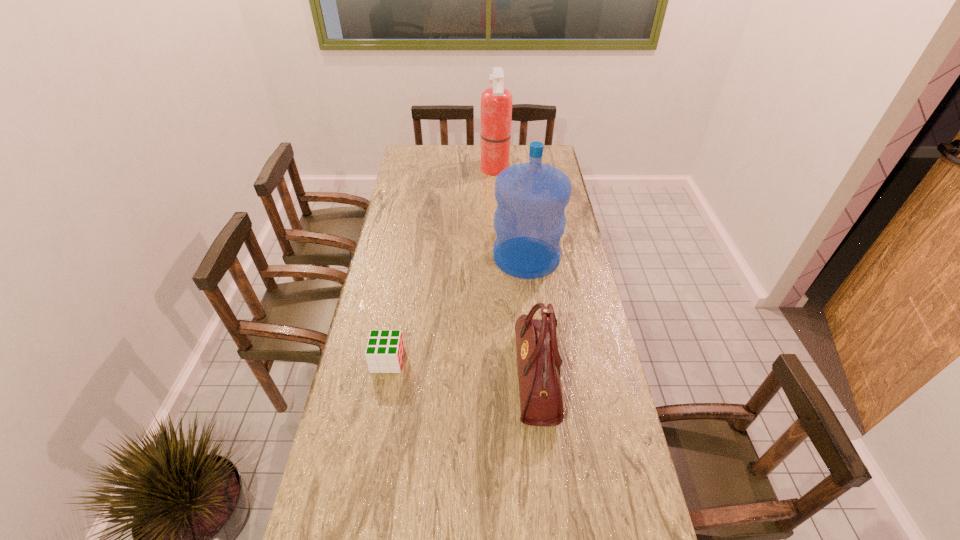
In order to click on free area in between the shortest object and the farthest object in this screenshot , I will do `click(442, 265)`.

Locate which object ranks third in proximity to the cube. Please provide its 2D coordinates. Your answer should be formatted as a tuple, i.e. [(x, y)], where the tuple contains the x and y coordinates of a point satisfying the conditions above.

[(496, 102)]

What are the coordinates of `object that is the third closest one to the fire extinguisher` in the screenshot? It's located at (384, 353).

In order to click on free location that satisfies the following two spatial constraints: 1. with the handle and hose on the fire extinguisher; 2. on the left side of the water jug in this screenshot , I will do `click(499, 257)`.

The height and width of the screenshot is (540, 960). Identify the location of vacant space that satisfies the following two spatial constraints: 1. on the back side of the second farthest object; 2. with the handle and hose on the farthest object. (516, 170).

At what (x,y) coordinates should I click in order to perform the action: click on vacant space that satisfies the following two spatial constraints: 1. on the front side of the water jug; 2. on the red face of the shortest object. Please return your answer as a coordinate pair (x, y). Looking at the image, I should click on (538, 361).

Identify the location of blank space that satisfies the following two spatial constraints: 1. with the handle and hose on the farthest object; 2. on the back side of the second farthest object. Image resolution: width=960 pixels, height=540 pixels. (499, 257).

You are a GUI agent. You are given a task and a screenshot of the screen. Output one action in this format:
    pyautogui.click(x=<x>, y=<y>)
    Task: Click on the free location that satisfies the following two spatial constraints: 1. with the handle and hose on the fire extinguisher; 2. on the left side of the third nearest object
    This screenshot has height=540, width=960.
    Given the screenshot: What is the action you would take?
    pyautogui.click(x=499, y=257)